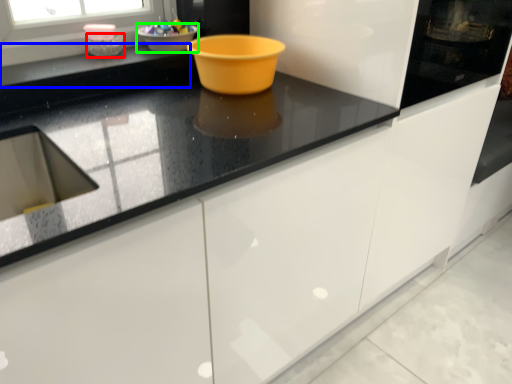
Question: Estimate the real-world distances between objects in this image. Which object is closer to basin (highlighted by a red box), counter top (highlighted by a blue box) or basin (highlighted by a green box)?

Choices:
 (A) counter top
 (B) basin

Answer: (A)